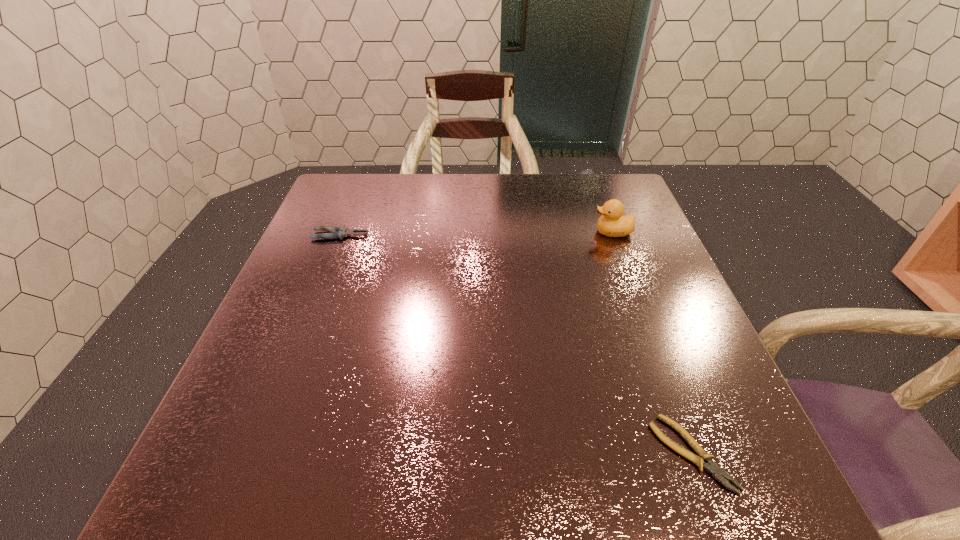
The image size is (960, 540). I want to click on empty space that is in between the leftmost object and the nearer pliers, so click(x=516, y=344).

Where is `free point between the duckling and the farther pliers`? free point between the duckling and the farther pliers is located at coordinates (476, 234).

This screenshot has width=960, height=540. What are the coordinates of `the second closest object to the nearest object` in the screenshot? It's located at pos(339,232).

Point out which object is positioned as the second nearest to the second shortest object. Please provide its 2D coordinates. Your answer should be formatted as a tuple, i.e. [(x, y)], where the tuple contains the x and y coordinates of a point satisfying the conditions above.

[(717, 472)]

Locate an element on the screen. This screenshot has height=540, width=960. free space that satisfies the following two spatial constraints: 1. facing forward on the duckling; 2. on the front side of the right pliers is located at coordinates (695, 453).

Where is `free space in the image that satisfies the following two spatial constraints: 1. at the gripping part of the left pliers; 2. on the left side of the shorter pliers`? Image resolution: width=960 pixels, height=540 pixels. free space in the image that satisfies the following two spatial constraints: 1. at the gripping part of the left pliers; 2. on the left side of the shorter pliers is located at coordinates pyautogui.click(x=254, y=453).

The width and height of the screenshot is (960, 540). In order to click on free point that satisfies the following two spatial constraints: 1. at the gripping part of the second shortest object; 2. on the back side of the nearest object in this screenshot , I will do `click(254, 453)`.

Find the location of a particular element. This screenshot has height=540, width=960. free spot that satisfies the following two spatial constraints: 1. at the gripping part of the nearer pliers; 2. on the left side of the taller pliers is located at coordinates (254, 453).

The image size is (960, 540). In order to click on vacant region that satisfies the following two spatial constraints: 1. at the gripping part of the nearer pliers; 2. on the right side of the leftmost object in this screenshot , I will do `click(254, 453)`.

The image size is (960, 540). Find the location of `free region that satisfies the following two spatial constraints: 1. at the gripping part of the right pliers; 2. on the right side of the second tallest object`. free region that satisfies the following two spatial constraints: 1. at the gripping part of the right pliers; 2. on the right side of the second tallest object is located at coordinates [254, 453].